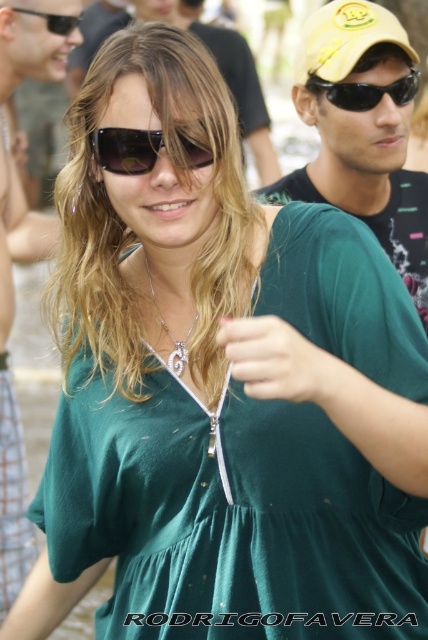
This screenshot has width=428, height=640. What do you see at coordinates (362, 131) in the screenshot?
I see `matte yellow cap at upper right` at bounding box center [362, 131].

Is matte yellow cap at upper right to the right of black plastic sunglasses at upper left from the viewer's perspective?

Correct, you'll find matte yellow cap at upper right to the right of black plastic sunglasses at upper left.

Is point (395, 92) positioned before point (39, 13)?

Yes, point (395, 92) is closer to viewer.

Where is `matte yellow cap at upper right`? matte yellow cap at upper right is located at coordinates (362, 131).

Is matte black sunglasses at upper left to the left of matte black sunglasses at upper center from the viewer's perspective?

Correct, you'll find matte black sunglasses at upper left to the left of matte black sunglasses at upper center.

Which is below, matte black sunglasses at upper left or matte black sunglasses at upper center?

matte black sunglasses at upper left

Is point (5, 196) positioned in front of point (273, 172)?

Yes, point (5, 196) is in front of point (273, 172).

Locate an element on the screen. matte black sunglasses at upper left is located at coordinates (20, 260).

Who is more forward, (x=344, y=26) or (x=406, y=76)?

Point (x=344, y=26)

This screenshot has width=428, height=640. In order to click on yellow fabric baseball cap at upper right in this screenshot , I will do `click(345, 38)`.